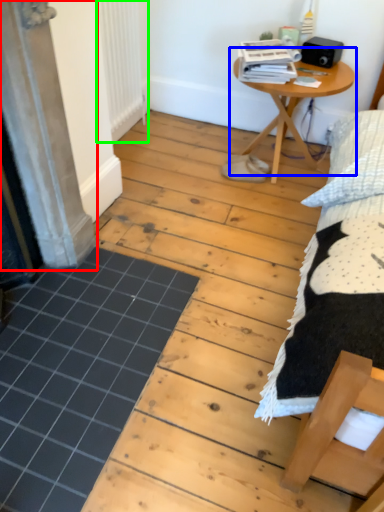
Question: Which is farther away from screen door (highlighted by a red box)? table (highlighted by a blue box) or radiator (highlighted by a green box)?

Choices:
 (A) table
 (B) radiator

Answer: (A)